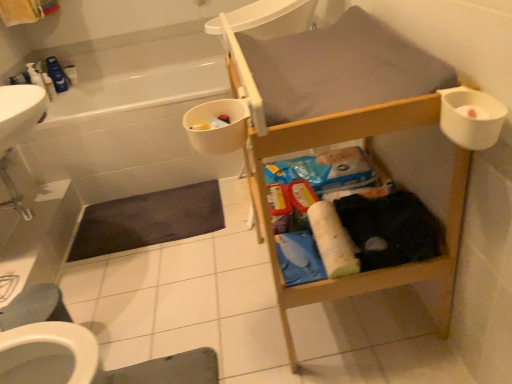
Locate an element on the screen. This screenshot has width=512, height=384. vacant location below dark matte bath mat at lower left, the first bath mat when ordered from top to bottom (from a real-world perspective) is located at coordinates tap(147, 215).